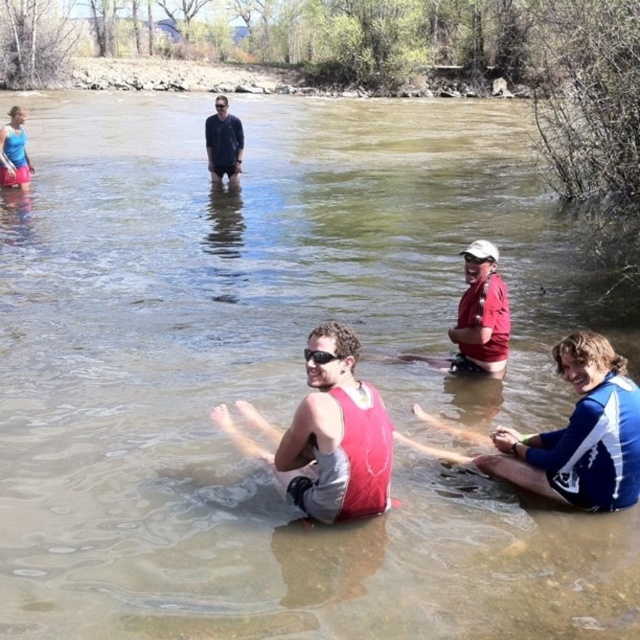
You are standing at the riverbank and want to locate the matte red tank top at center. According to the coordinates provided, in which direction should you look relative to your position?

The matte red tank top at center is located at coordinates point (332,436), so you should look towards the center of the image to find it.

You are a photographer trying to capture a closeup shot of the clear plastic goggles at center. The matte red tank top at center is blocking your view. Can you estimate whether the goggles are smaller than the tank top?

The matte red tank top at center has a larger size compared to clear plastic goggles at center, so yes, the goggles are smaller than the tank top.